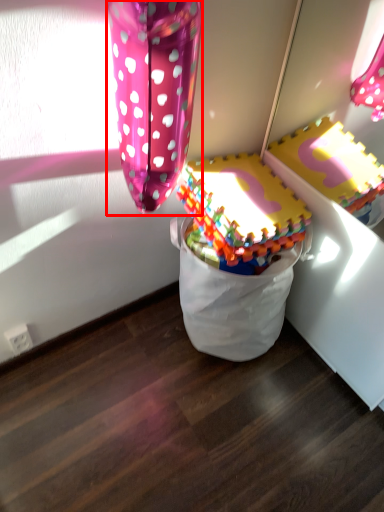
Question: From the image's perspective, considering the relative positions of balloon (annotated by the red box) and toy in the image provided, where is balloon (annotated by the red box) located with respect to the staircase?

Choices:
 (A) below
 (B) above

Answer: (B)